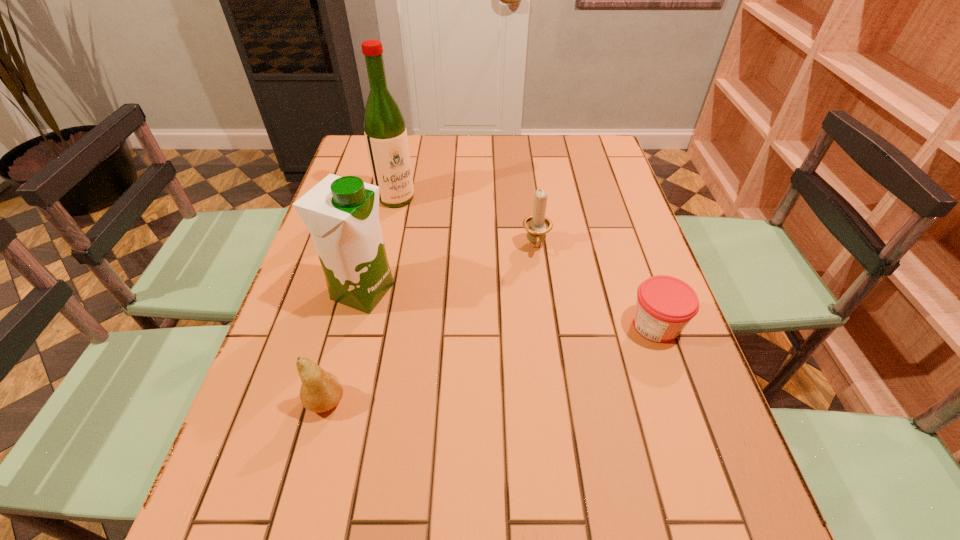
Where is `free space on the desktop that is between the pear and the shortest object and is positioned on the label of the tallest object`? Image resolution: width=960 pixels, height=540 pixels. free space on the desktop that is between the pear and the shortest object and is positioned on the label of the tallest object is located at coordinates (526, 355).

Identify the location of vacant space on the desktop that is between the second shortest object and the shortest object and is positioned on the handle side of the second farthest object. This screenshot has width=960, height=540. click(x=540, y=352).

At what (x,y) coordinates should I click in order to perform the action: click on free spot on the desktop that is between the nearest object and the rightmost object and is positioned on the front-facing side of the fourth shortest object. Please return your answer as a coordinate pair (x, y). Looking at the image, I should click on (535, 353).